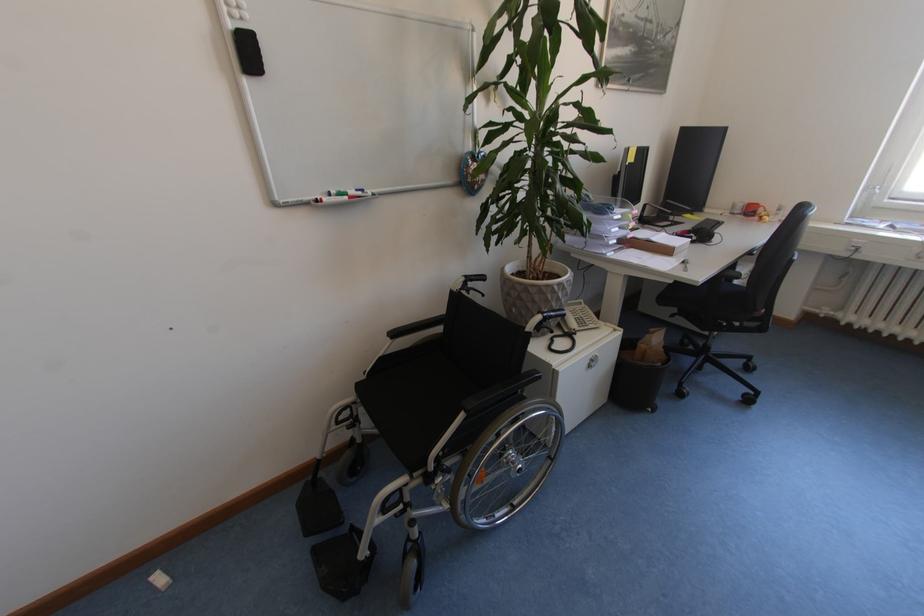
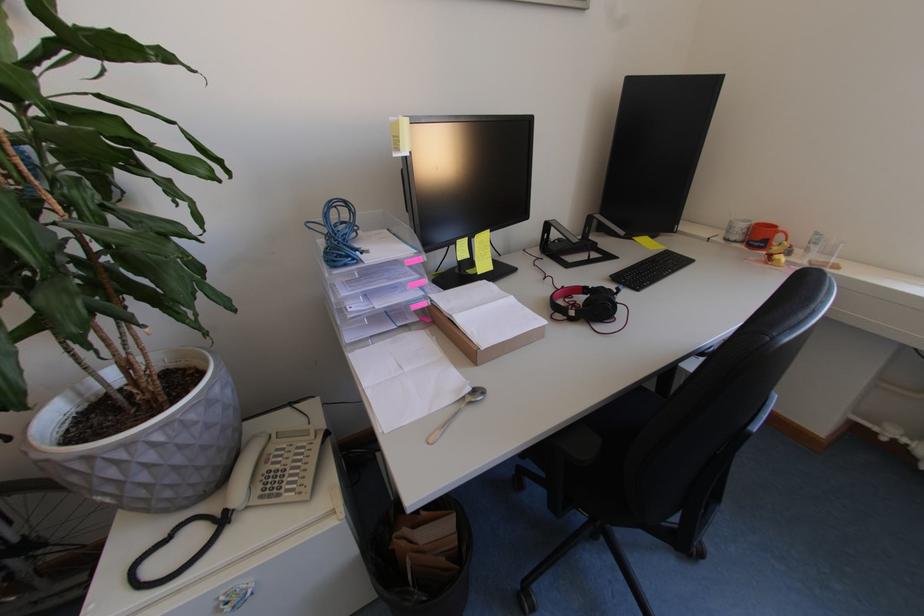
Find the pixel in the second image that matches the point at 784,216 in the first image.

(816, 253)